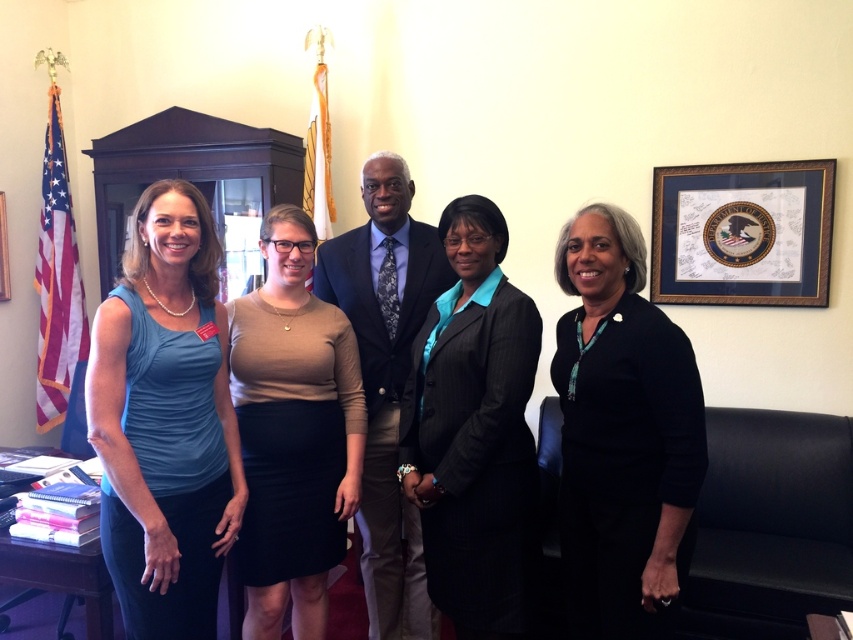
Can you confirm if black pinstripe suit at center is taller than gold-framed picture at upper right?

Correct, black pinstripe suit at center is much taller as gold-framed picture at upper right.

The image size is (853, 640). Describe the element at coordinates (473, 432) in the screenshot. I see `black pinstripe suit at center` at that location.

Locate an element on the screen. black pinstripe suit at center is located at coordinates (473, 432).

Is brown matte dress at center bigger than dark blue suit at center?

→ No, brown matte dress at center is not bigger than dark blue suit at center.

Which is behind, point (282, 563) or point (366, 262)?

Point (366, 262)

Locate an element on the screen. The image size is (853, 640). brown matte dress at center is located at coordinates (293, 433).

Does point (136, 600) come closer to viewer compared to point (357, 355)?

That is True.

Who is positioned more to the right, blue fabric dress at left or brown matte dress at center?

From the viewer's perspective, brown matte dress at center appears more on the right side.

The height and width of the screenshot is (640, 853). In order to click on blue fabric dress at left in this screenshot , I will do `click(165, 420)`.

This screenshot has height=640, width=853. I want to click on blue fabric dress at left, so click(165, 420).